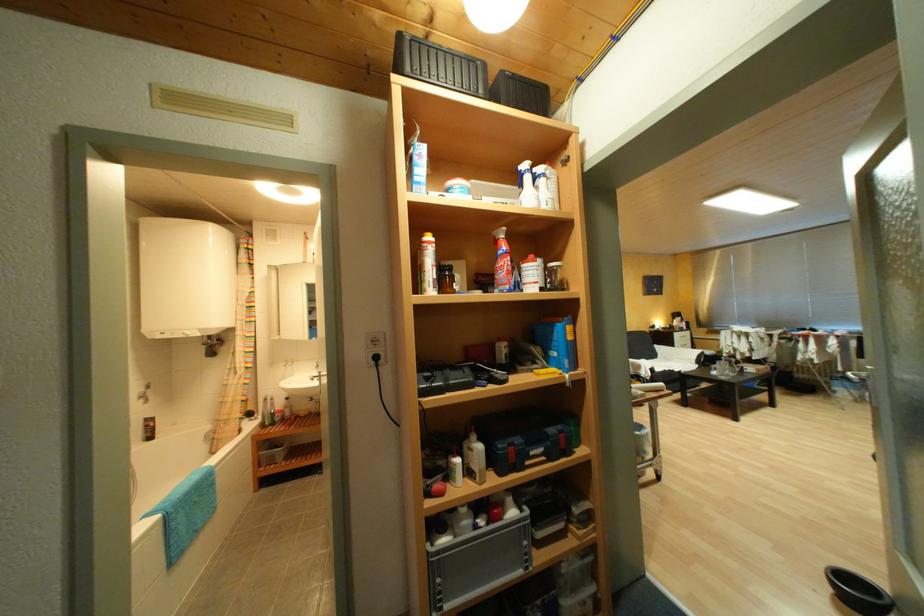
Find where to lift the green toolbox handle. Please return your answer as a coordinate pair (x, y).

(439, 65)